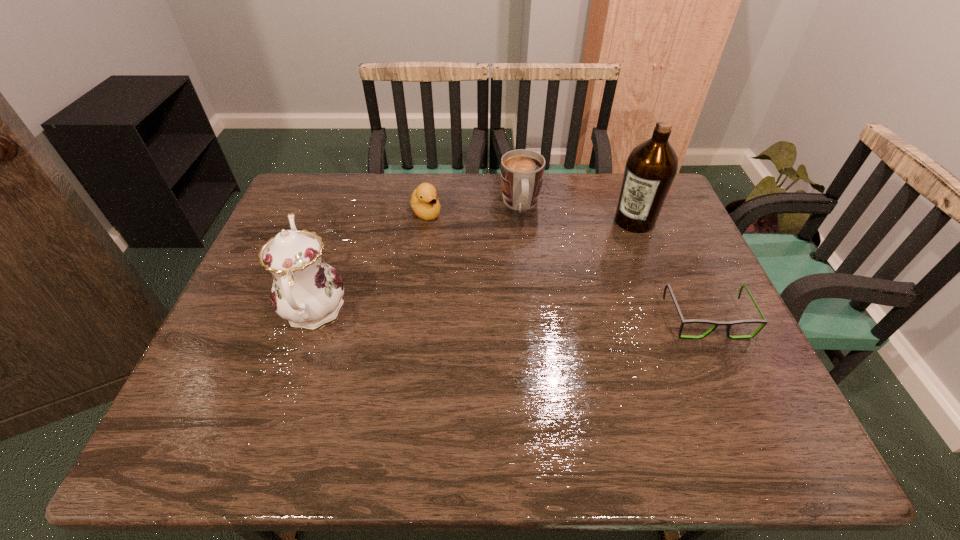
The height and width of the screenshot is (540, 960). Find the location of `free spot between the shortest object and the third object from left to right`. free spot between the shortest object and the third object from left to right is located at coordinates (613, 262).

The height and width of the screenshot is (540, 960). Find the location of `vacant area between the olive oil and the chinaware`. vacant area between the olive oil and the chinaware is located at coordinates (474, 266).

Where is `object that stands as the fourth closest to the tallest object`? This screenshot has width=960, height=540. object that stands as the fourth closest to the tallest object is located at coordinates (306, 291).

Locate an element on the screen. the fourth closest object relative to the third object from left to right is located at coordinates (306, 291).

At what (x,y) coordinates should I click in order to perform the action: click on free space that satisfies the following two spatial constraints: 1. on the front side of the duckling; 2. on the left side of the olive oil. Please return your answer as a coordinate pair (x, y). Looking at the image, I should click on (424, 221).

Identify the location of vacant point that satisfies the following two spatial constraints: 1. on the back side of the fourth shortest object; 2. on the left side of the mug. (349, 206).